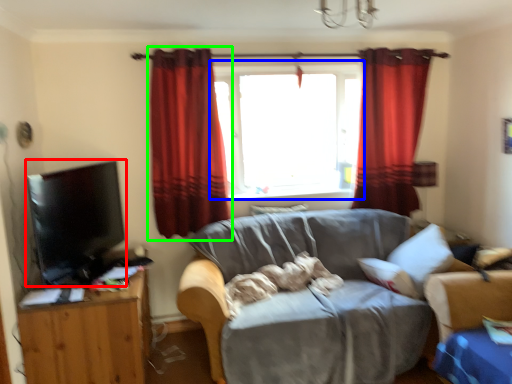
Question: Which object is positioned farthest from flat (highlighted by a red box)? Select from window (highlighted by a blue box) and curtain (highlighted by a green box).

Choices:
 (A) window
 (B) curtain

Answer: (A)